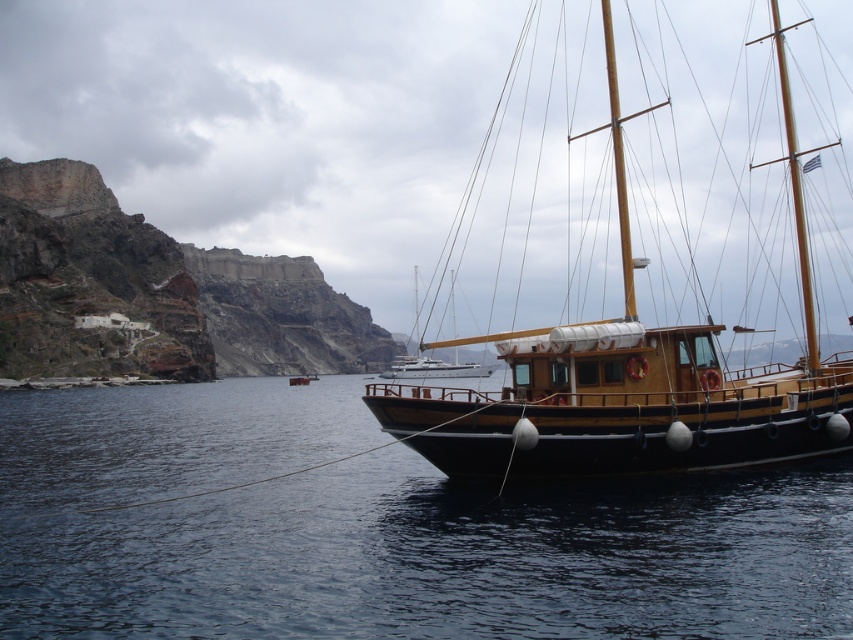
Is dark blue water at lower left thinner than wooden sailboat at right?

Correct, dark blue water at lower left's width is less than wooden sailboat at right's.

Can you confirm if dark blue water at lower left is positioned to the left of wooden sailboat at right?

Yes, dark blue water at lower left is to the left of wooden sailboat at right.

Is point (44, 547) closer to camera compared to point (799, 384)?

That is True.

The image size is (853, 640). Find the location of `dark blue water at lower left`. dark blue water at lower left is located at coordinates (383, 531).